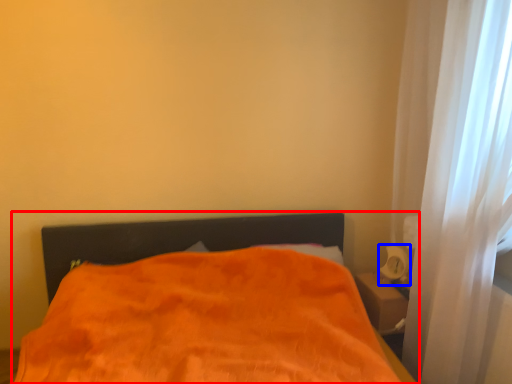
Question: Which point is further to the camera, bed (highlighted by a red box) or table lamp (highlighted by a blue box)?

Choices:
 (A) bed
 (B) table lamp

Answer: (B)